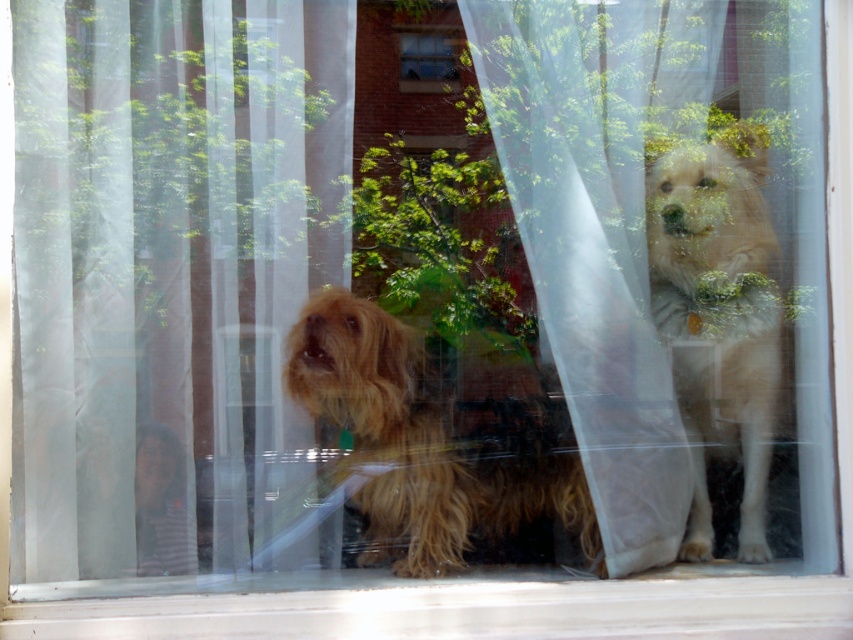
Question: Which point appears closest to the camera in this image?

Choices:
 (A) 426,42
 (B) 138,236

Answer: (B)

Question: Considering the real-world distances, which object is closest to the clear glass window at center?

Choices:
 (A) translucent white curtain at left
 (B) fuzzy brown dog at center

Answer: (A)

Question: Is translucent white curtain at left wider than fuzzy brown dog at center?

Choices:
 (A) no
 (B) yes

Answer: (A)

Question: Which point appears closest to the camera in this image?

Choices:
 (A) coord(428,512)
 (B) coord(447,38)

Answer: (A)

Question: Can you confirm if translucent white curtain at left is positioned below clear glass window at center?

Choices:
 (A) yes
 (B) no

Answer: (A)

Question: Does translucent white curtain at left have a lesser width compared to fuzzy brown dog at center?

Choices:
 (A) no
 (B) yes

Answer: (B)